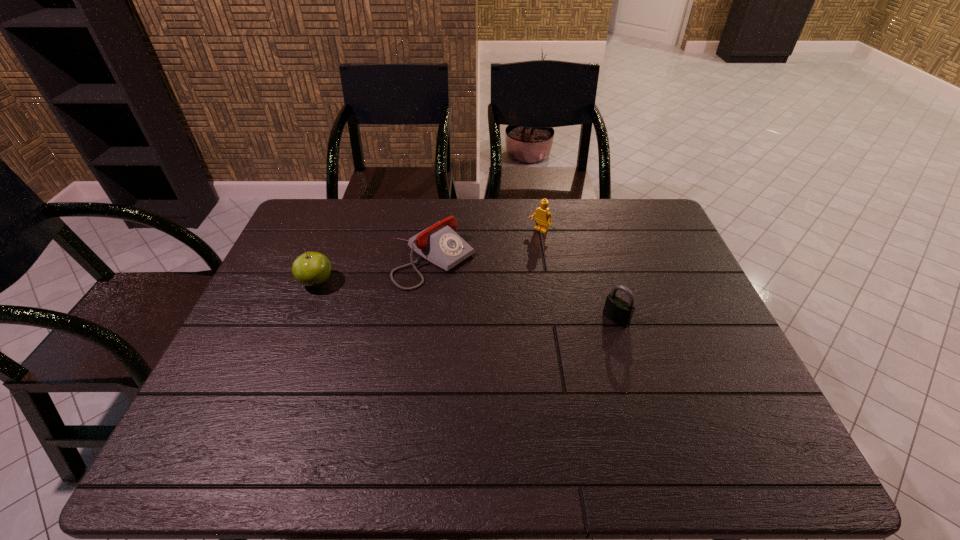
This screenshot has height=540, width=960. Identify the location of free space on the desktop that is between the leftmost object and the rightmost object and is positioned on the dial of the telephone. (505, 306).

The height and width of the screenshot is (540, 960). Find the location of `free space on the desktop that is between the leftmost object and the rightmost object and is positioned on the face of the Lego`. free space on the desktop that is between the leftmost object and the rightmost object and is positioned on the face of the Lego is located at coordinates (464, 300).